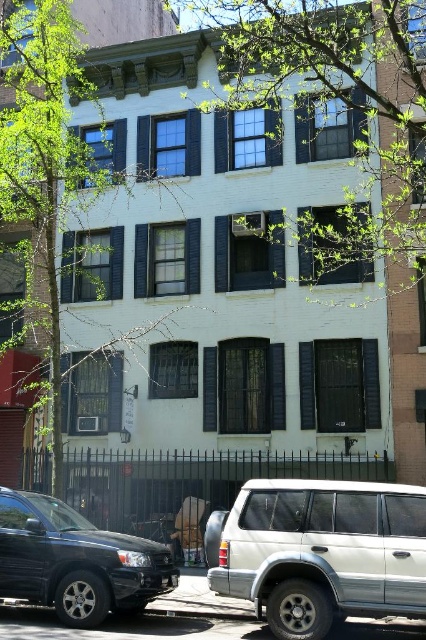
This screenshot has width=426, height=640. Describe the element at coordinates (339, 108) in the screenshot. I see `green leafy tree at center` at that location.

Which is behind, point (319, 97) or point (68, 525)?

Point (319, 97)

Measure the distance between point (x=362, y=193) and camera.

17.65 meters

The height and width of the screenshot is (640, 426). I want to click on green leafy tree at center, so click(x=339, y=108).

Can you confirm if green leafy tree at center is taller than green leafy tree at upper left?

Indeed, green leafy tree at center has a greater height compared to green leafy tree at upper left.

Who is lower down, green leafy tree at center or green leafy tree at upper left?

green leafy tree at upper left is lower down.

Who is more distant from viewer, (393, 84) or (57, 385)?

The point (393, 84) is more distant.

At what (x,y) coordinates should I click in order to perform the action: click on green leafy tree at center. Please return your answer as a coordinate pair (x, y). The width and height of the screenshot is (426, 640). Looking at the image, I should click on (339, 108).

Between point (317, 552) and point (89, 177), which one is positioned behind?

The point (89, 177) is more distant.

Who is more forward, [302,564] or [25,198]?

Point [302,564] is in front.

Is point (316, 538) positioned before point (81, 86)?

Yes, it is in front of point (81, 86).

Where is `metallic silver minivan at center`? The height and width of the screenshot is (640, 426). metallic silver minivan at center is located at coordinates (324, 552).